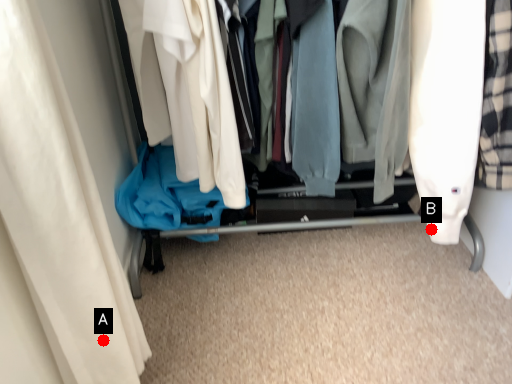
Question: Two points are circled on the image, labeled by A and B beside each circle. Which point is closer to the camera taking this photo?

Choices:
 (A) A is closer
 (B) B is closer

Answer: (A)